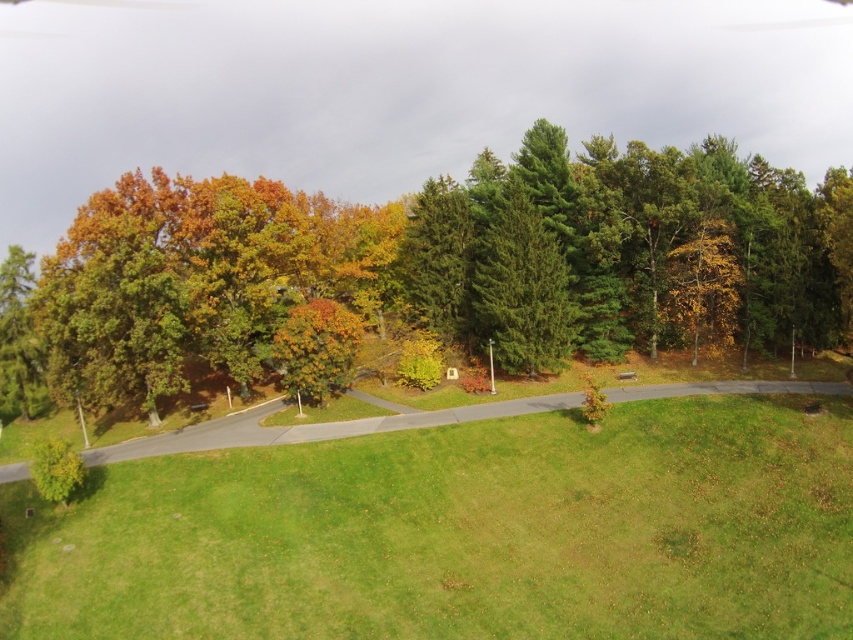
What is the color of the area at point (461, 532)?

The area at point (461, 532) is green grassy field at center.

Based on the scene description, where is the green grassy field at center located in the image?

The green grassy field at center is located at point (461,532).